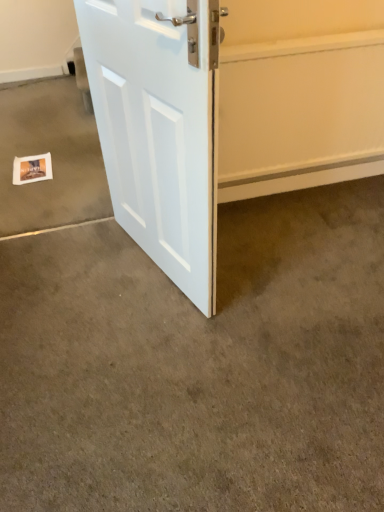
Question: Does smooth carpet at center, positioned as the second concrete in back-to-front order, touch white paper postcard at lower left?

Choices:
 (A) no
 (B) yes

Answer: (A)

Question: Is white paper postcard at lower left inside smooth carpet at center, positioned as the second concrete in back-to-front order?

Choices:
 (A) no
 (B) yes

Answer: (A)

Question: Is smooth carpet at center, which ranks as the 1th concrete in front-to-back order, located outside white paper postcard at lower left?

Choices:
 (A) no
 (B) yes

Answer: (B)

Question: Is smooth carpet at center, positioned as the second concrete in back-to-front order, positioned behind white paper postcard at lower left?

Choices:
 (A) yes
 (B) no

Answer: (B)

Question: Is smooth carpet at center, positioned as the second concrete in back-to-front order, oriented away from white paper postcard at lower left?

Choices:
 (A) no
 (B) yes

Answer: (A)

Question: Choose the correct answer: Is white painted wood door at center inside white paper postcard at lower left or outside it?

Choices:
 (A) outside
 (B) inside

Answer: (A)

Question: Considering their positions, is white painted wood door at center located in front of or behind white paper postcard at lower left?

Choices:
 (A) front
 (B) behind

Answer: (A)

Question: Considering the positions of white painted wood door at center and white paper postcard at lower left in the image, is white painted wood door at center bigger or smaller than white paper postcard at lower left?

Choices:
 (A) small
 (B) big

Answer: (B)

Question: From the image's perspective, is white painted wood door at center positioned above or below white paper postcard at lower left?

Choices:
 (A) above
 (B) below

Answer: (B)

Question: In terms of height, does white painted wood door at center look taller or shorter compared to white paper at lower left, acting as the 1th concrete starting from the back?

Choices:
 (A) short
 (B) tall

Answer: (B)

Question: From the image's perspective, relative to white paper at lower left, acting as the 1th concrete starting from the back, is white painted wood door at center above or below?

Choices:
 (A) below
 (B) above

Answer: (A)

Question: Is white painted wood door at center inside the boundaries of white paper at lower left, acting as the 1th concrete starting from the back, or outside?

Choices:
 (A) outside
 (B) inside

Answer: (A)

Question: From a real-world perspective, is white painted wood door at center above or below white paper at lower left, the 2th concrete in the front-to-back sequence?

Choices:
 (A) below
 (B) above

Answer: (B)

Question: Considering the positions of point (36, 166) and point (9, 192), is point (36, 166) closer or farther from the camera than point (9, 192)?

Choices:
 (A) closer
 (B) farther

Answer: (B)

Question: Choose the correct answer: Is white paper postcard at lower left inside white paper at lower left, the 2th concrete in the front-to-back sequence, or outside it?

Choices:
 (A) inside
 (B) outside

Answer: (A)